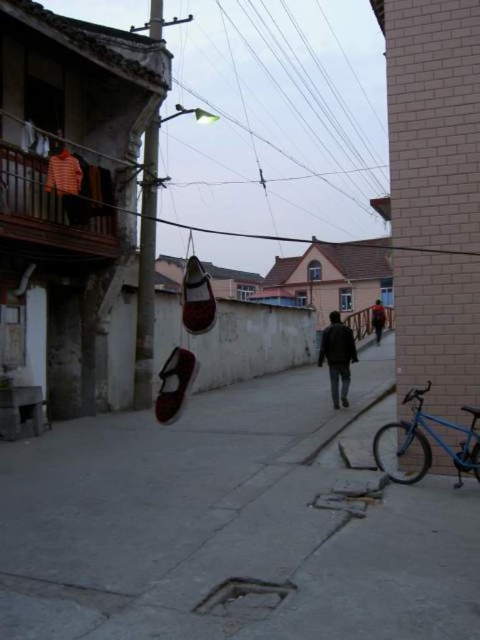
In order to click on blue matte bicycle at lower right in this screenshot , I will do `click(429, 442)`.

Between point (471, 460) and point (345, 394), which one is positioned in front?

Positioned in front is point (471, 460).

Which is behind, point (468, 465) or point (326, 358)?

The point (326, 358) is more distant.

Where is `blue matte bicycle at lower right`? This screenshot has height=640, width=480. blue matte bicycle at lower right is located at coordinates (429, 442).

Who is more distant from viewer, (x=64, y=545) or (x=381, y=332)?

The point (x=381, y=332) is behind.

Who is more forward, (112, 476) or (383, 321)?

Point (112, 476) is in front.

At what (x,y) coordinates should I click in order to perform the action: click on concrete sidewalk at center. Please return your answer as a coordinate pair (x, y). Image resolution: width=480 pixels, height=640 pixels. Looking at the image, I should click on (231, 525).

Is concrete sidewalk at center taller than dark blue jeans at center?

No, concrete sidewalk at center is not taller than dark blue jeans at center.

Can you confirm if concrete sidewalk at center is shorter than dark blue jeans at center?

Yes.

I want to click on concrete sidewalk at center, so click(231, 525).

The image size is (480, 640). What are the coordinates of `concrete sidewalk at center` in the screenshot? It's located at (231, 525).